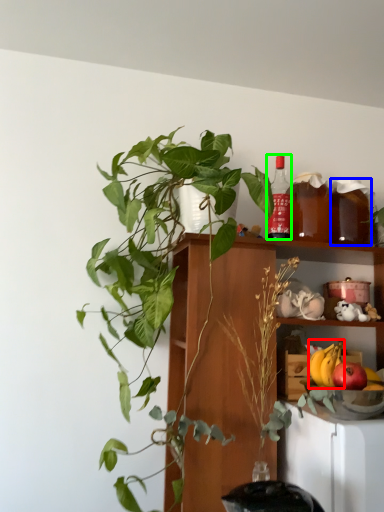
Question: Which object is the farthest from banana (highlighted by a red box)? Choose among these: beverage (highlighted by a blue box) or bottle (highlighted by a green box).

Choices:
 (A) beverage
 (B) bottle

Answer: (B)